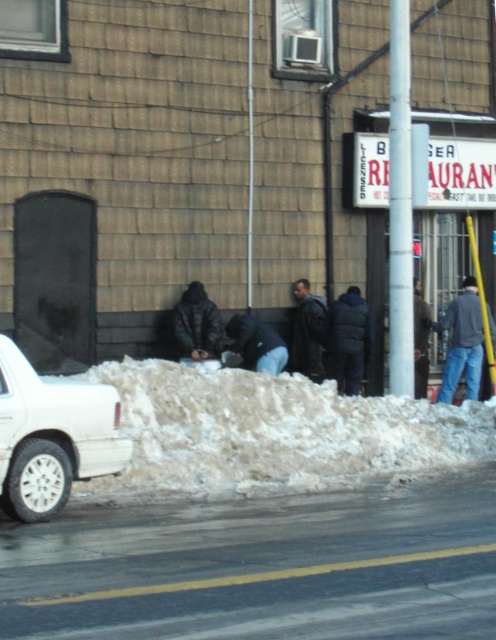
You are standing at the center of the image and want to reach the white fluffy snow at lower center. Based on the coordinates provided in the description, in which direction should you move to get there?

The white fluffy snow at lower center is located at coordinates point (273, 433). Since the y coordinate is 0.552, which is below the center point of 0.5, you should move downward to reach it.

You are a delivery person trying to reach the door of the building. You see the white fluffy snow at lower center and the dark blue jeans at right. Which obstacle is wider and might block your path more?

The white fluffy snow at lower center might be wider than the dark blue jeans at right, so it could block the path more.

You are a delivery person trying to park your white car on the left side of the frame. There is a large pile of snow in the foreground. Where should you avoid parking to prevent getting stuck? Please provide coordinates in the format of a point like this example format point (273, 433).

The point (273, 433) marks white fluffy snow at lower center, so you should avoid parking near that area to prevent getting stuck.